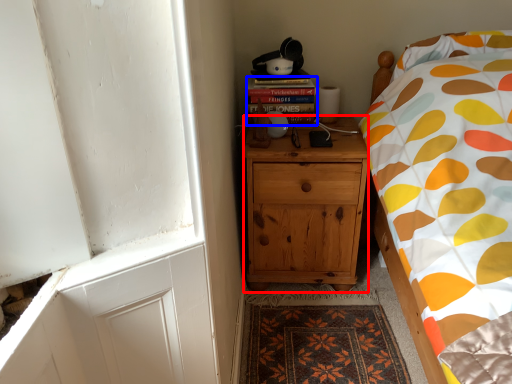
Question: Which object appears closest to the camera in this image, cabinetry (highlighted by a red box) or book (highlighted by a blue box)?

Choices:
 (A) cabinetry
 (B) book

Answer: (A)